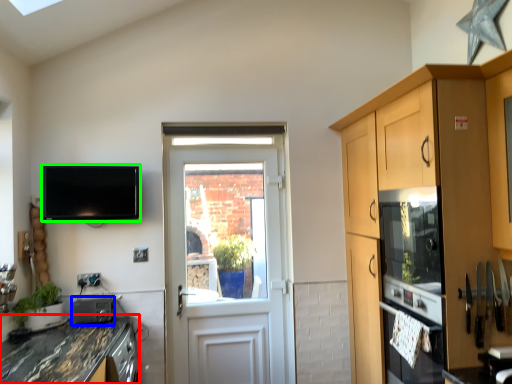
Question: Based on their relative distances, which object is farther from countertop (highlighted by a red box)? Choose from appliance (highlighted by a blue box) and television (highlighted by a green box).

Choices:
 (A) appliance
 (B) television

Answer: (B)